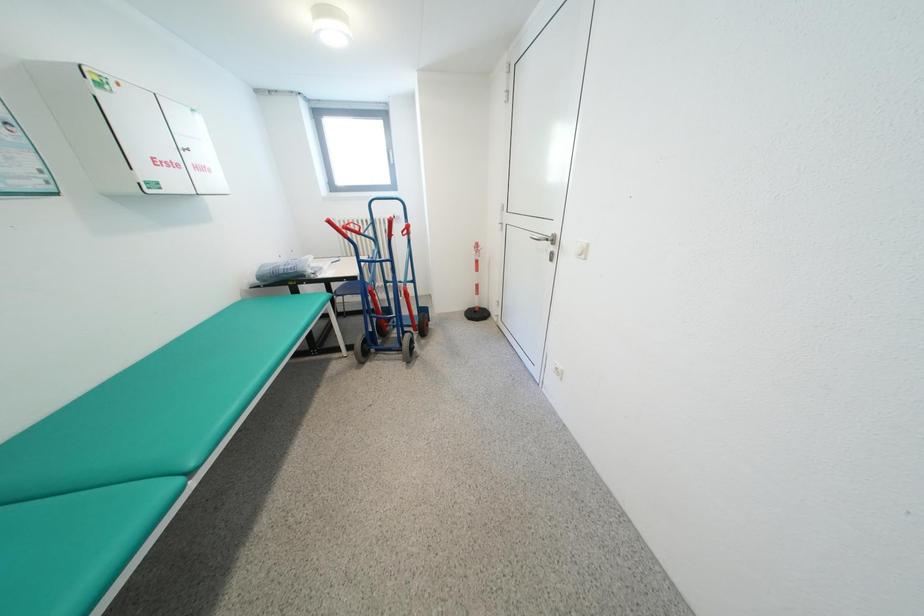
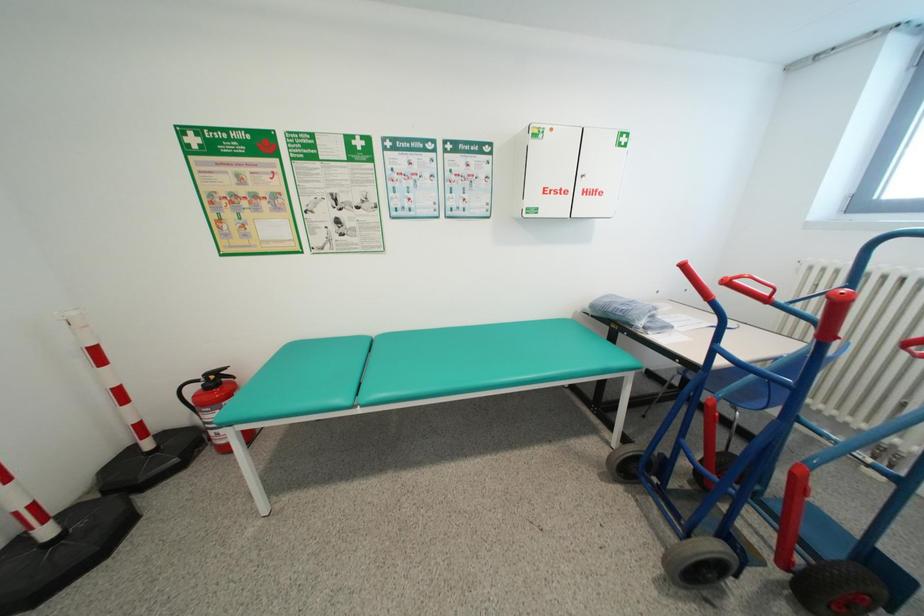
How did the camera likely rotate?

The camera's rotation is toward left-down.